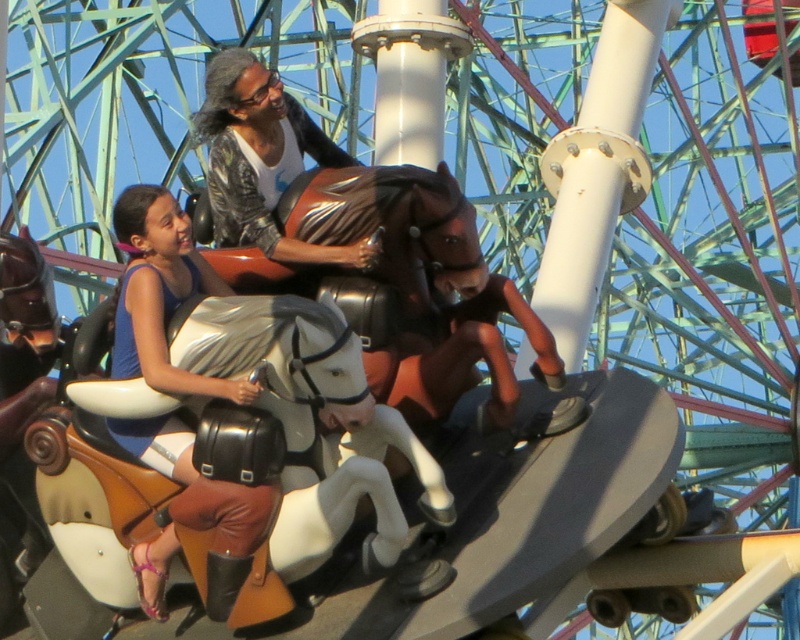
You are standing at the entrance of the carousel and see the matte black vest at center and the matte black jacket at upper center. Which one is closer to the ground?

The matte black vest at center is located below the matte black jacket at upper center, so it is closer to the ground.

You are a costume designer preparing for a play set at an amusement park. You need to choose between the matte black vest at center and the matte black jacket at upper center for a character who needs to move freely during a dance sequence. Based on the image, which item would allow for more mobility?

The matte black vest at center occupies less space than the matte black jacket at upper center, so it would allow for more mobility during the dance sequence.

You are a photographer at the fairground and want to capture both the matte black vest at center and the matte black jacket at upper center in a single frame. Considering their sizes, which one might you need to position closer to the camera to ensure both appear similarly sized in the photo?

The matte black vest at center has a lesser width compared to the matte black jacket at upper center. To make them appear similarly sized in the photo, you should position the matte black vest at center closer to the camera since it is smaller in width.